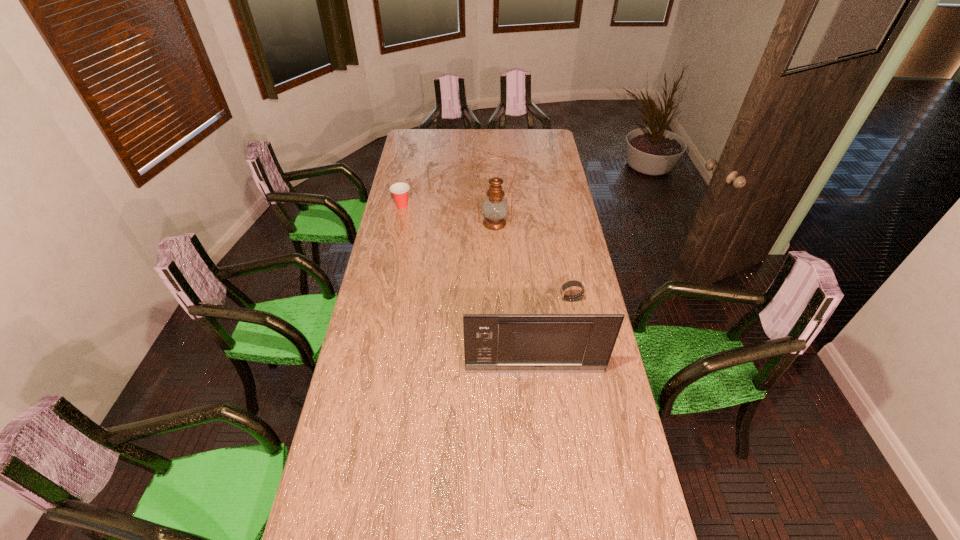
The image size is (960, 540). Find the location of `vacant space positioned on the face of the watch`. vacant space positioned on the face of the watch is located at coordinates (517, 299).

Where is `free space located 0.310m on the face of the watch`? The image size is (960, 540). free space located 0.310m on the face of the watch is located at coordinates (483, 299).

Locate an element on the screen. object at the left edge is located at coordinates (399, 190).

Locate an element on the screen. Image resolution: width=960 pixels, height=540 pixels. microwave oven located at the right edge is located at coordinates (493, 343).

I want to click on watch that is at the right edge, so click(x=572, y=283).

In the image, there is a desktop. At what (x,y) coordinates should I click in order to perform the action: click on vacant space at the left edge. Please return your answer as a coordinate pair (x, y). Looking at the image, I should click on (385, 262).

Locate an element on the screen. vacant space at the right edge of the desktop is located at coordinates (572, 222).

At what (x,y) coordinates should I click in order to perform the action: click on vacant position at the far right corner of the desktop. Please return your answer as a coordinate pair (x, y). This screenshot has height=540, width=960. Looking at the image, I should click on (540, 144).

Image resolution: width=960 pixels, height=540 pixels. Identify the location of free space between the second tallest object and the oil lamp. (515, 297).

Locate an element on the screen. The width and height of the screenshot is (960, 540). free spot between the watch and the second farthest object is located at coordinates (533, 261).